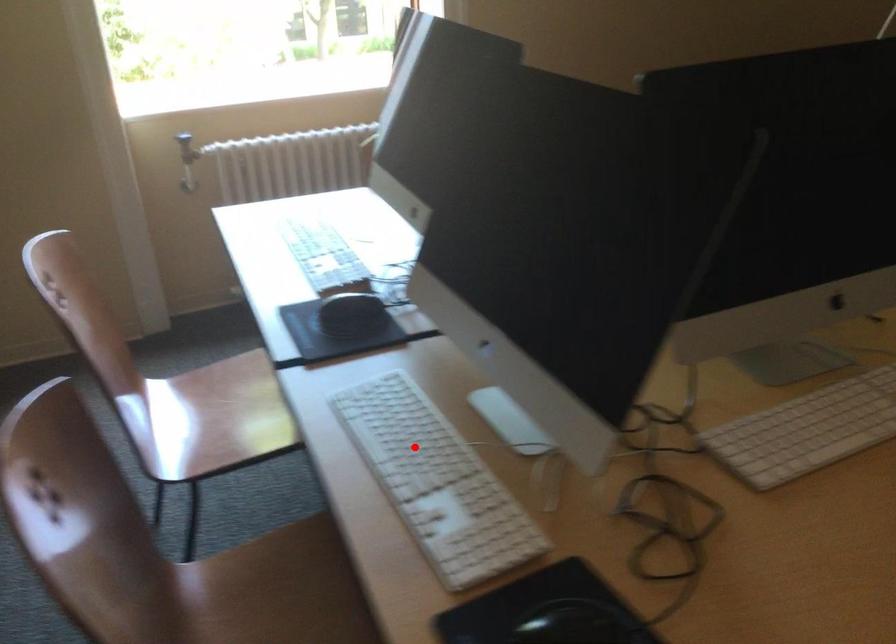
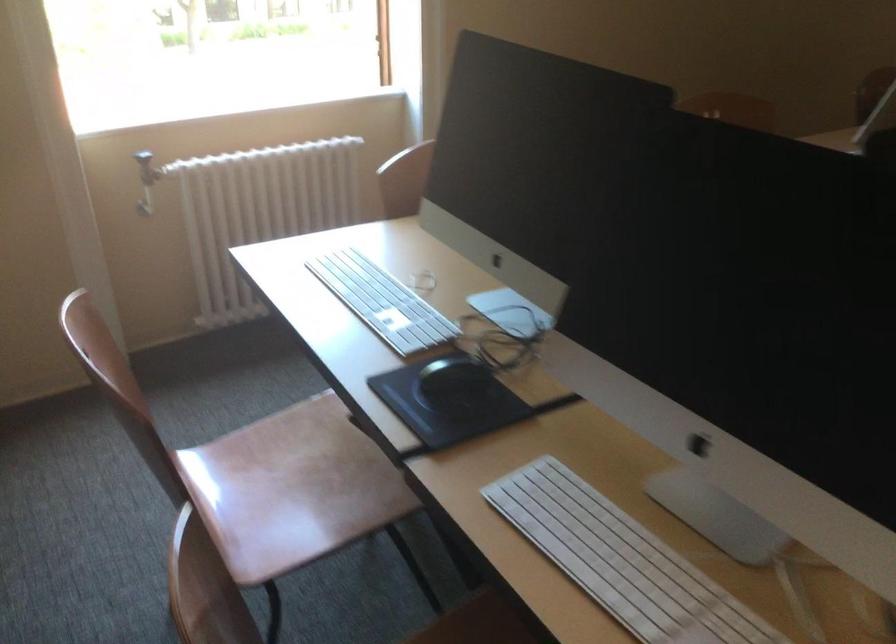
Locate, in the second image, the point that corresponds to the highlighted location in the first image.

(622, 561)